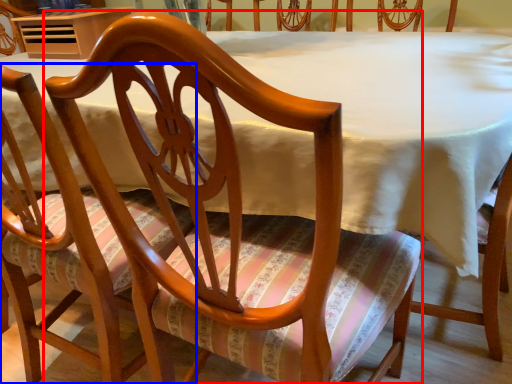
Question: Which of the following is the farthest to the observer, chair (highlighted by a red box) or chair (highlighted by a blue box)?

Choices:
 (A) chair
 (B) chair

Answer: (B)